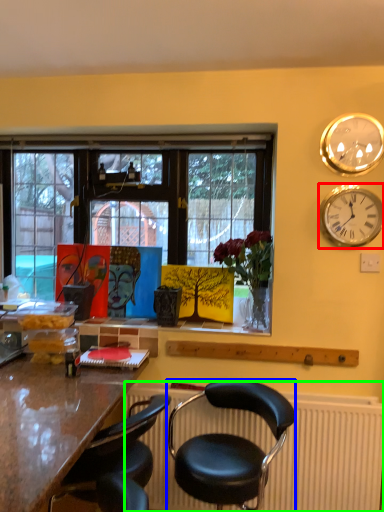
Question: Which is nearer to the wall clock (highlighted by a red box)? chair (highlighted by a blue box) or radiator (highlighted by a green box).

Choices:
 (A) chair
 (B) radiator

Answer: (B)